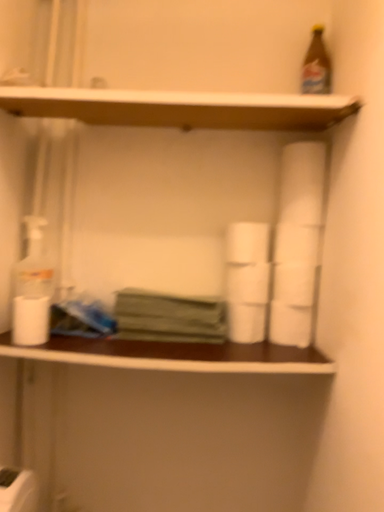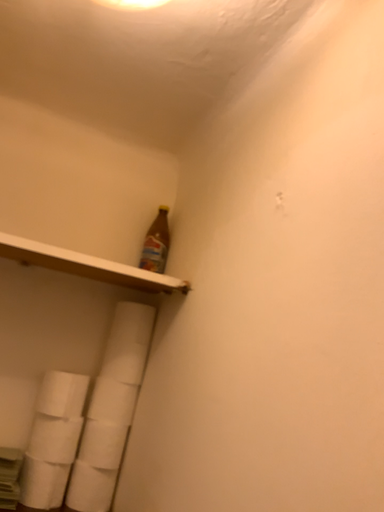
Question: How did the camera likely rotate when shooting the video?

Choices:
 (A) rotated downward
 (B) rotated upward

Answer: (B)